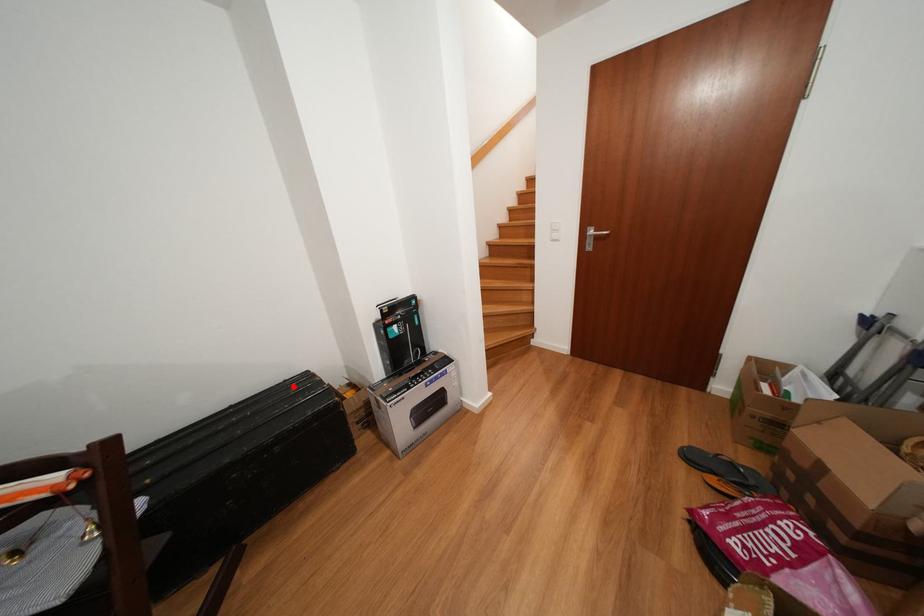
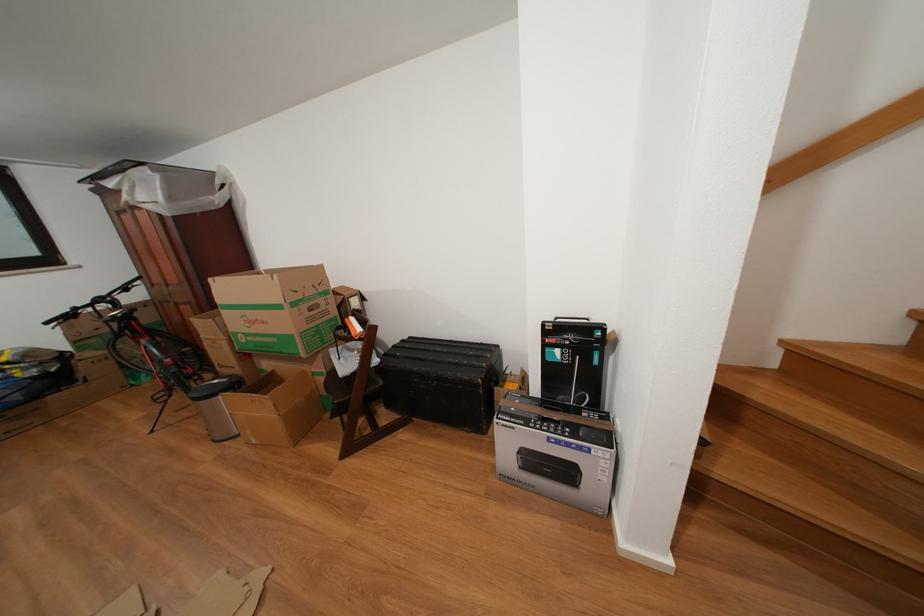
Find the pixel in the second image that matches the highlighted location in the first image.

(490, 349)